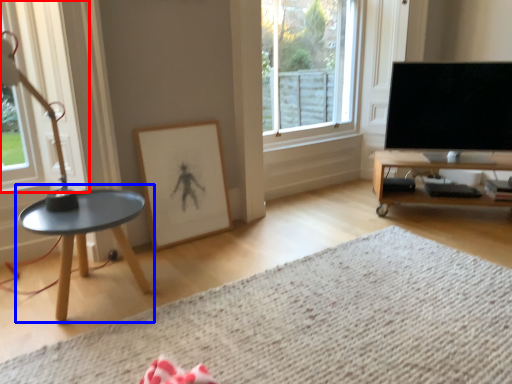
Question: Which of the following is the closest to the observer, window (highlighted by a red box) or coffee table (highlighted by a blue box)?

Choices:
 (A) window
 (B) coffee table

Answer: (A)